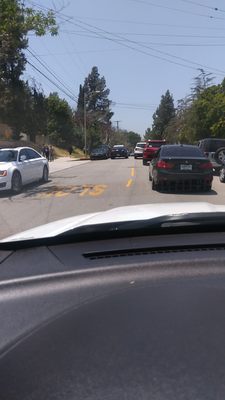
Find the location of `wires`. wires is located at coordinates pyautogui.click(x=103, y=30).